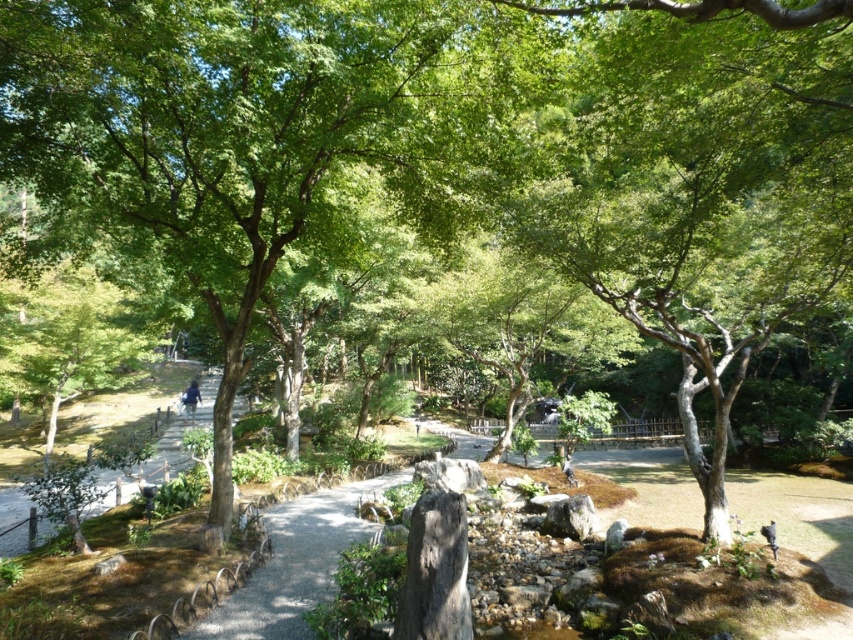
Describe the element at coordinates (296, 563) in the screenshot. I see `gravel path at center` at that location.

Which of these two, gravel path at center or dark brown wooden person at center, stands shorter?

With less height is dark brown wooden person at center.

The image size is (853, 640). I want to click on gravel path at center, so click(296, 563).

Where is `gravel path at center`? The width and height of the screenshot is (853, 640). gravel path at center is located at coordinates point(296,563).

Is gravel path at center shorter than blue fabric person at lower center?

Yes.

Is gravel path at center above blue fabric person at lower center?

Actually, gravel path at center is below blue fabric person at lower center.

Which is in front, point (334, 515) or point (184, 410)?

Positioned in front is point (334, 515).

Locate an element on the screen. gravel path at center is located at coordinates (296, 563).

Can you confirm if gravel path at center is positioned below gravel pathway at lower left?

No.

Looking at this image, does gravel path at center have a greater height compared to gravel pathway at lower left?

In fact, gravel path at center may be shorter than gravel pathway at lower left.

Who is more forward, (236, 600) or (107, 412)?

Positioned in front is point (236, 600).

What are the coordinates of `gravel path at center` in the screenshot? It's located at (296, 563).